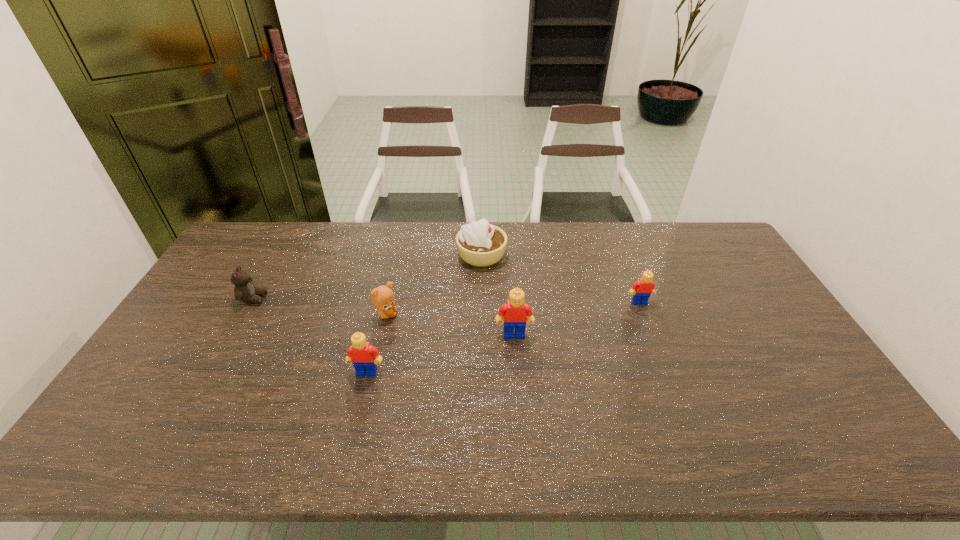
This screenshot has height=540, width=960. In the image, there is a desktop. What are the coordinates of `free space at the right edge` in the screenshot? It's located at (757, 336).

In the image, there is a desktop. Where is `vacant area at the far left corner`? The image size is (960, 540). vacant area at the far left corner is located at coordinates (275, 233).

The width and height of the screenshot is (960, 540). I want to click on vacant area at the far right corner of the desktop, so click(x=708, y=224).

The width and height of the screenshot is (960, 540). Find the location of `free space at the near right corner of the desktop`. free space at the near right corner of the desktop is located at coordinates (823, 393).

Locate an element on the screen. This screenshot has width=960, height=540. blank region between the nearest object and the farthest object is located at coordinates (424, 313).

Identify the location of free point between the right teddy bear and the leftmost Lego. Image resolution: width=960 pixels, height=540 pixels. (376, 343).

Where is `vacant area that lies between the second farthest Lego and the farthest object`? vacant area that lies between the second farthest Lego and the farthest object is located at coordinates (497, 294).

Image resolution: width=960 pixels, height=540 pixels. Identify the location of vacant area between the right teddy bear and the leftmost object. (320, 307).

At what (x,y) coordinates should I click in order to perform the action: click on empty space that is in between the left teddy bear and the farthest Lego. Please return your answer as a coordinate pair (x, y). This screenshot has height=540, width=960. Looking at the image, I should click on (446, 300).

Find the location of a particular element. This screenshot has height=540, width=960. vacant space that's between the nearest Lego and the right teddy bear is located at coordinates (376, 343).